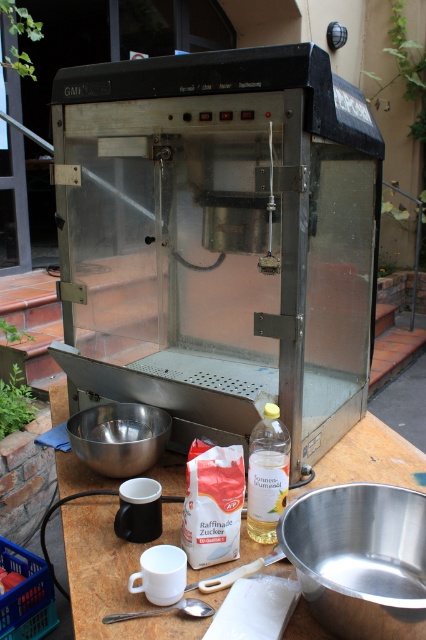
You are setting up a popcorn bar and need to place a decorative bowl between the metallic table at center and the white matte sugar packet at lower center. The bowl has a diameter of 8 inches. Will it fit snugly between them without overlapping either object?

The metallic table at center and white matte sugar packet at lower center are 7.97 inches apart. Since the bowl has a diameter of 8 inches, it will not fit snugly between them as it would be slightly larger than the available space.

You are standing at the edge of the wooden table where the popcorn machine is placed. There is a point marked at coordinates (109,577) on the table. What object is located at that point?

The point at coordinates (109,577) corresponds to the metallic table at center.

You are standing in front of the popcorn machine and want to grab an item from the table. You notice two points marked on the table. Which point is closer to you, point (81,417) or point (132,435)?

Point (81,417) is closer to the viewer than point (132,435).